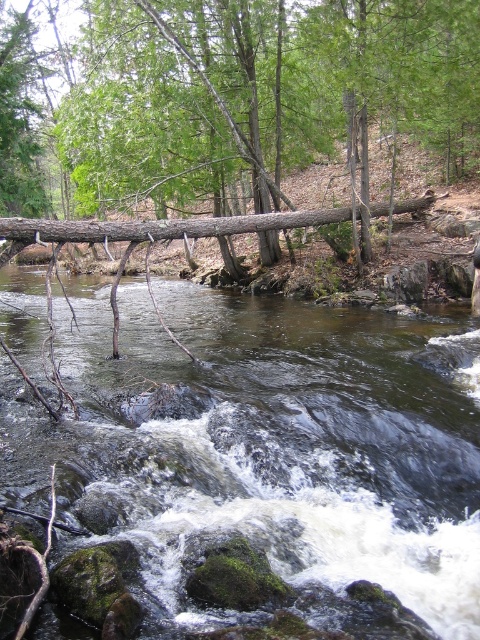
You are standing at the origin point of the image. Which direction should you move to reach the dark green mossy rocks at center?

The dark green mossy rocks at center are located at coordinates point (x=267, y=442), so you should move to the right and slightly upwards to reach them.

You are a hiker carrying a backpack and need to cross the stream. The dark green mossy rocks at center and the brown rough log at center are both in the stream. Which object is closer to the starting point on your left side?

The dark green mossy rocks at center are closer to the starting point on your left side because they are positioned 7.84 meters away from the brown rough log at center, implying the rocks are nearer to the hiker.

You are a hiker trying to cross the stream using the brown rough log at center. You notice dark green mossy rocks at center nearby. Which object takes up more space in the scene?

The brown rough log at center occupies more space than the dark green mossy rocks at center in the scene.